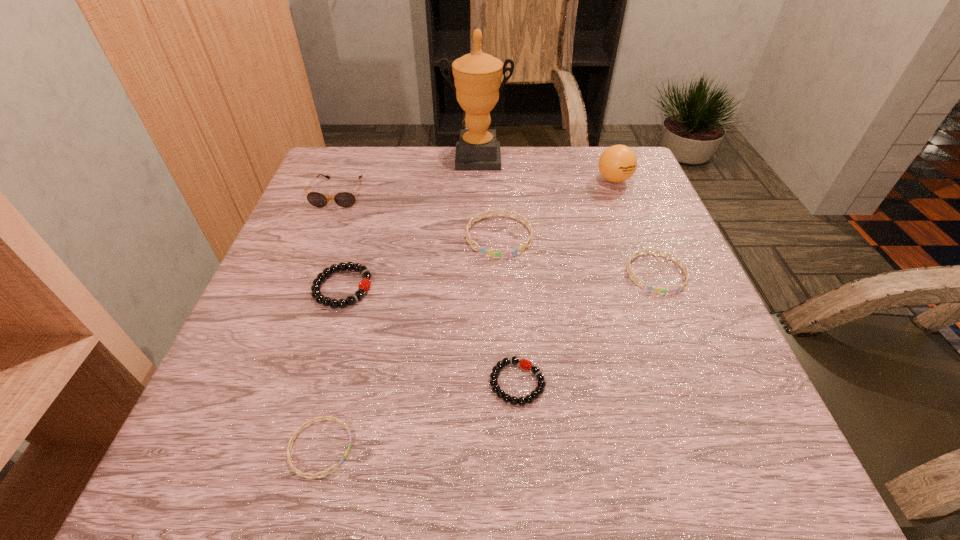
At what (x,y) coordinates should I click in order to perform the action: click on award. Please return your answer as a coordinate pair (x, y). The height and width of the screenshot is (540, 960). Looking at the image, I should click on (477, 76).

This screenshot has width=960, height=540. I want to click on golden award, so click(477, 76).

Image resolution: width=960 pixels, height=540 pixels. I want to click on the seventh shortest object, so click(x=617, y=163).

Find the location of a particular element. This screenshot has height=540, width=960. the third tallest object is located at coordinates (343, 199).

In order to click on black sunglasses in this screenshot , I will do `click(343, 199)`.

You are a GUI agent. You are given a task and a screenshot of the screen. Output one action in this format:
    pyautogui.click(x=<x>, y=<y>)
    Task: Click on the second blue bracelet from right to left
    This screenshot has width=960, height=540.
    Given the screenshot: What is the action you would take?
    pyautogui.click(x=482, y=250)

Identify the location of the left black bracelet. (365, 284).

The image size is (960, 540). I want to click on the bigger black bracelet, so click(x=365, y=284).

Where is `the rightmost blue bracelet`? This screenshot has width=960, height=540. the rightmost blue bracelet is located at coordinates (650, 288).

Locate an element on the screen. the second smallest blue bracelet is located at coordinates (650, 288).